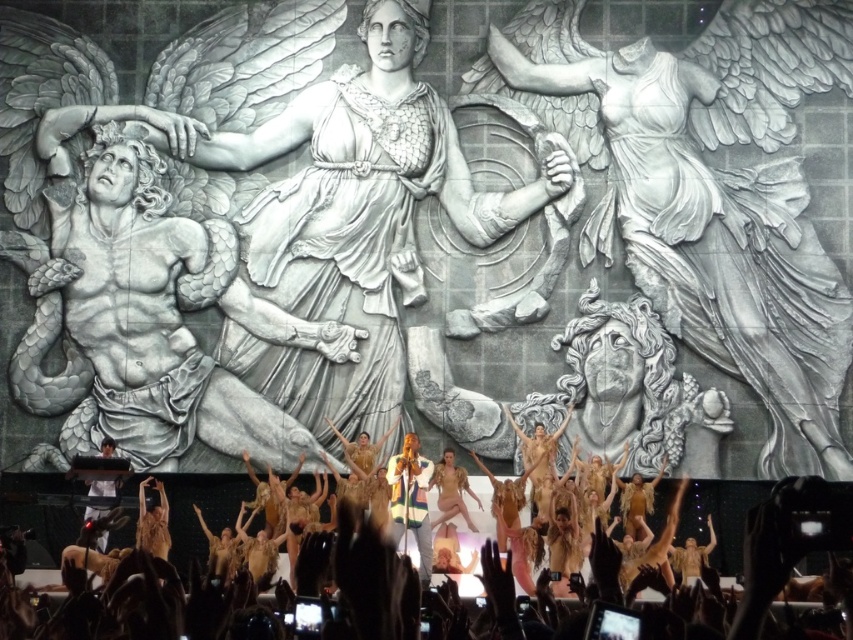
You are a photographer positioned at the back of the stage. You want to capture a photo that includes both the gray stone man at left and the brown feathered costumes at lower center. Considering their sizes, which object should you focus on first to ensure both are in frame?

The gray stone man at left is smaller in size compared to the brown feathered costumes at lower center. To ensure both are in frame, focus on the gray stone man at left first since it is smaller and might require adjusting the camera angle to include both.

You are a stagehand preparing to move a 6.5 feet long equipment cart from the gray stone man at left to the white marble statue at center. Can the cart fit in the space between them?

The distance between the white marble statue at center and the gray stone man at left is 7.08 feet, which is greater than the 6.5 feet length of the equipment cart. Therefore, the cart can fit in the space between them.

You are a stagehand preparing to adjust the lighting for the performance. You need to ensure that the gray stone man at left and the brown feathered costumes at lower center are both adequately lit. Given their sizes, which object might require a closer light source to ensure proper illumination?

The gray stone man at left is taller than the brown feathered costumes at lower center, so the gray stone man at left might require a closer light source to ensure proper illumination due to its greater height.